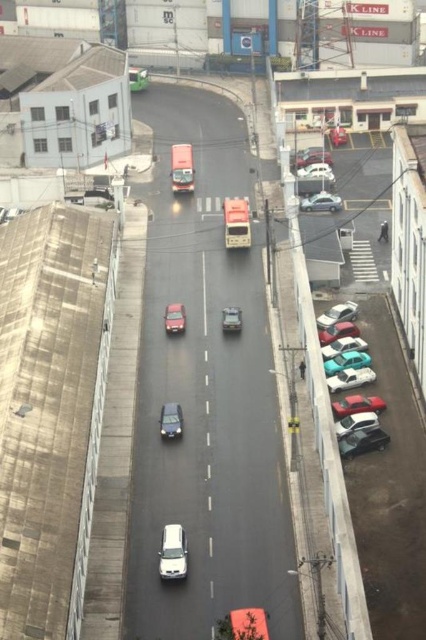
Question: Observing the image, what is the correct spatial positioning of white matte van at center in reference to shiny silver car at center?

Choices:
 (A) right
 (B) left

Answer: (A)

Question: Which of the following is the farthest from the observer?

Choices:
 (A) shiny red car at center
 (B) matte silver van at center

Answer: (B)

Question: Among these points, which one is nearest to the camera?

Choices:
 (A) (172, 524)
 (B) (172, 404)
 (C) (337, 369)

Answer: (A)

Question: Does teal glossy car at right appear on the right side of shiny red car at center?

Choices:
 (A) yes
 (B) no

Answer: (A)

Question: Can you confirm if teal glossy car at right is positioned to the left of shiny silver car at center?

Choices:
 (A) no
 (B) yes

Answer: (A)

Question: Considering the real-world distances, which object is farthest from the metallic silver sedan at center-right?

Choices:
 (A) matte silver van at center
 (B) white matte van at center

Answer: (B)